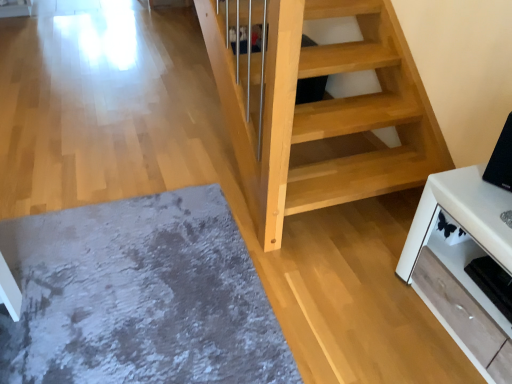
What do you see at coordinates (463, 263) in the screenshot? I see `white glossy tv stand at lower right` at bounding box center [463, 263].

This screenshot has height=384, width=512. I want to click on white glossy tv stand at lower right, so click(463, 263).

Can you confirm if gray shaggy rug at lower left is shorter than black glossy tv at upper right?

Correct, gray shaggy rug at lower left is not as tall as black glossy tv at upper right.

Is point (170, 334) farther from camera compared to point (483, 177)?

Yes.

Would you consider gray shaggy rug at lower left to be distant from black glossy tv at upper right?

gray shaggy rug at lower left is positioned a significant distance from black glossy tv at upper right.

Is white glossy tv stand at lower right positioned far away from black glossy tv at upper right?

No, white glossy tv stand at lower right is not far from black glossy tv at upper right.

Which is behind, point (462, 344) or point (501, 137)?

Point (501, 137)

Can you confirm if white glossy tv stand at lower right is thinner than black glossy tv at upper right?

In fact, white glossy tv stand at lower right might be wider than black glossy tv at upper right.

Can you confirm if white glossy tv stand at lower right is positioned to the left of black glossy tv at upper right?

Indeed, white glossy tv stand at lower right is positioned on the left side of black glossy tv at upper right.

Which object is further away from the camera, gray shaggy rug at lower left or white glossy tv stand at lower right?

gray shaggy rug at lower left is behind.

Is point (143, 362) closer or farther from the camera than point (454, 338)?

Clearly, point (143, 362) is closer to the camera than point (454, 338).

Is gray shaggy rug at lower left far from white glossy tv stand at lower right?

No, gray shaggy rug at lower left is in close proximity to white glossy tv stand at lower right.

Could you tell me if gray shaggy rug at lower left is facing white glossy tv stand at lower right?

No, gray shaggy rug at lower left is not oriented towards white glossy tv stand at lower right.

From the image's perspective, would you say black glossy tv at upper right is shown under gray shaggy rug at lower left?

No, from the image's perspective, black glossy tv at upper right is not beneath gray shaggy rug at lower left.

From the picture: Is the position of black glossy tv at upper right more distant than that of gray shaggy rug at lower left?

Yes, the depth of black glossy tv at upper right is greater than that of gray shaggy rug at lower left.

From a real-world perspective, which is physically above, black glossy tv at upper right or white glossy tv stand at lower right?

black glossy tv at upper right.

Looking at this image, based on their positions, is black glossy tv at upper right located to the left or right of white glossy tv stand at lower right?

Clearly, black glossy tv at upper right is on the right of white glossy tv stand at lower right in the image.

Measure the distance between black glossy tv at upper right and white glossy tv stand at lower right.

black glossy tv at upper right and white glossy tv stand at lower right are 11.01 inches apart.

Can you confirm if black glossy tv at upper right is thinner than white glossy tv stand at lower right?

Yes, black glossy tv at upper right is thinner than white glossy tv stand at lower right.

Consider the image. Considering the sizes of objects white glossy tv stand at lower right and gray shaggy rug at lower left in the image provided, who is thinner, white glossy tv stand at lower right or gray shaggy rug at lower left?

Thinner between the two is white glossy tv stand at lower right.

From the image's perspective, is white glossy tv stand at lower right over gray shaggy rug at lower left?

Correct, white glossy tv stand at lower right appears higher than gray shaggy rug at lower left in the image.

Does white glossy tv stand at lower right have a lesser height compared to gray shaggy rug at lower left?

Incorrect, the height of white glossy tv stand at lower right does not fall short of that of gray shaggy rug at lower left.

Is white glossy tv stand at lower right surrounding gray shaggy rug at lower left?

No, gray shaggy rug at lower left is not surrounded by white glossy tv stand at lower right.

This screenshot has width=512, height=384. I want to click on mat that appears on the left of black glossy tv at upper right, so click(x=139, y=296).

Identify the location of furniture below the black glossy tv at upper right (from a real-world perspective). The width and height of the screenshot is (512, 384). (463, 263).

Which object lies further to the anchor point black glossy tv at upper right, white glossy tv stand at lower right or gray shaggy rug at lower left?

gray shaggy rug at lower left lies further to black glossy tv at upper right than the other object.

Which object lies nearer to the anchor point gray shaggy rug at lower left, white glossy tv stand at lower right or black glossy tv at upper right?

The object closer to gray shaggy rug at lower left is white glossy tv stand at lower right.

Looking at this image, from the image, which object appears to be farther from white glossy tv stand at lower right, black glossy tv at upper right or gray shaggy rug at lower left?

gray shaggy rug at lower left is positioned further to the anchor white glossy tv stand at lower right.

From the picture: Which object lies nearer to the anchor point gray shaggy rug at lower left, black glossy tv at upper right or white glossy tv stand at lower right?

white glossy tv stand at lower right lies closer to gray shaggy rug at lower left than the other object.

Which object lies further to the anchor point white glossy tv stand at lower right, gray shaggy rug at lower left or black glossy tv at upper right?

Among the two, gray shaggy rug at lower left is located further to white glossy tv stand at lower right.

Which object lies further to the anchor point black glossy tv at upper right, gray shaggy rug at lower left or white glossy tv stand at lower right?

gray shaggy rug at lower left lies further to black glossy tv at upper right than the other object.

At what (x,y) coordinates should I click in order to perform the action: click on furniture between gray shaggy rug at lower left and black glossy tv at upper right from left to right. Please return your answer as a coordinate pair (x, y). The image size is (512, 384). Looking at the image, I should click on (463, 263).